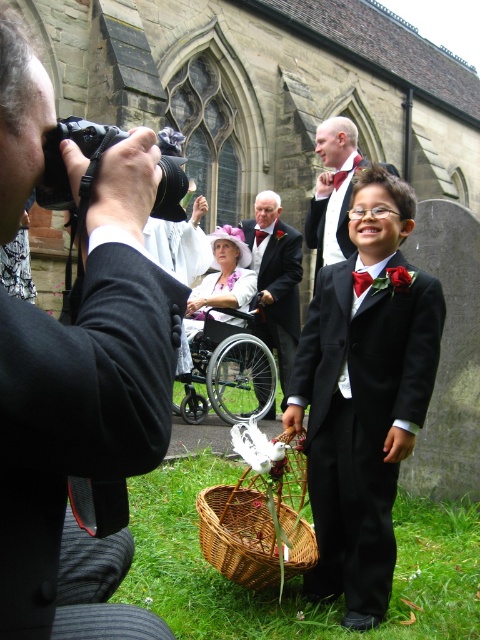
Is woven brown basket at lower center shorter than shiny black suit at center?

Indeed, woven brown basket at lower center has a lesser height compared to shiny black suit at center.

Can you confirm if woven brown basket at lower center is wider than shiny black suit at center?

Yes, woven brown basket at lower center is wider than shiny black suit at center.

Is point (236, 488) closer to viewer compared to point (336, 163)?

Yes, point (236, 488) is closer to viewer.

You are a GUI agent. You are given a task and a screenshot of the screen. Output one action in this format:
    pyautogui.click(x=<x>, y=<y>)
    Task: Click on the woven brown basket at lower center
    
    Given the screenshot: What is the action you would take?
    pyautogui.click(x=260, y=513)

Is point (184, 404) positioned after point (344, 164)?

No, it is in front of (344, 164).

Who is more forward, (204,320) or (391,164)?

Point (204,320) is more forward.

Between point (247, 337) and point (344, 150), which one is positioned in front?

Positioned in front is point (247, 337).

At what (x,y) coordinates should I click in order to perform the action: click on black plastic wheelchair at center. Please return your answer as a coordinate pair (x, y). Image resolution: width=480 pixels, height=640 pixels. Looking at the image, I should click on (228, 374).

Can you confirm if matte black suit at center is wider than red satin bow tie at center?

Correct, the width of matte black suit at center exceeds that of red satin bow tie at center.

Between matte black suit at center and red satin bow tie at center, which one has more height?

Standing taller between the two is matte black suit at center.

Who is more distant from viewer, (261,282) or (266,236)?

The point (266,236) is behind.

Image resolution: width=480 pixels, height=640 pixels. I want to click on matte black suit at center, so click(x=276, y=280).